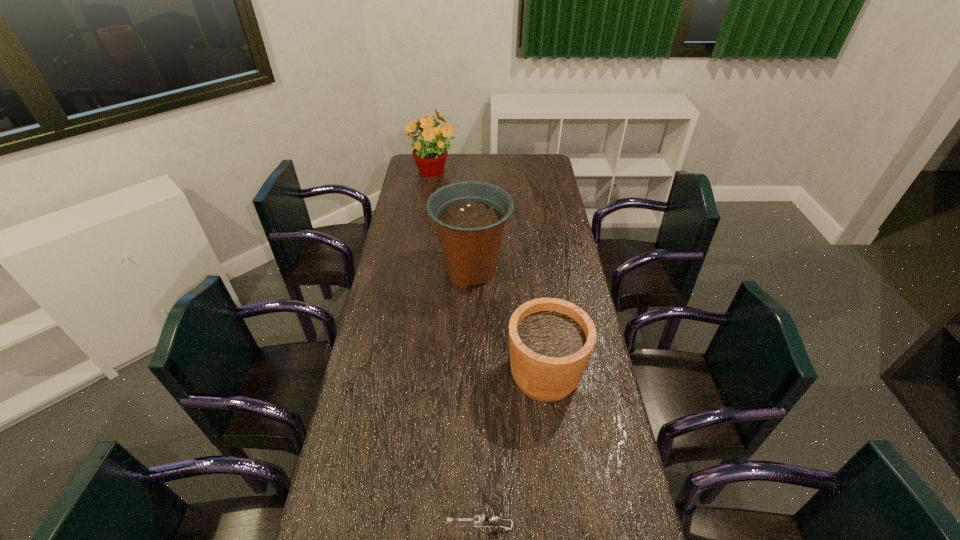
Identify the location of free space that is in between the nearest flowerpot and the second farthest flowerpot. The height and width of the screenshot is (540, 960). (508, 322).

Identify the location of free space that is in between the shortest object and the third tallest object. (513, 451).

Find the location of `vacant space in between the shortest object and the second shortest object`. vacant space in between the shortest object and the second shortest object is located at coordinates (513, 451).

The height and width of the screenshot is (540, 960). I want to click on empty space that is in between the shortest flowerpot and the third nearest object, so click(x=508, y=322).

Image resolution: width=960 pixels, height=540 pixels. I want to click on empty location between the nearest object and the second farthest object, so click(476, 399).

You are a GUI agent. You are given a task and a screenshot of the screen. Output one action in this format:
    pyautogui.click(x=<x>, y=<y>)
    Task: Click on the object identified as the second closest to the farthest object
    The image size is (960, 540).
    Given the screenshot: What is the action you would take?
    pyautogui.click(x=551, y=340)

Identify the location of object that can be found as the closest to the third nearest object. (551, 340).

Locate an element on the screen. The image size is (960, 540). flowerpot that stands as the closest to the third nearest object is located at coordinates (551, 340).

Select which flowerpot appears as the closest to the farthest object. Please provide its 2D coordinates. Your answer should be formatted as a tuple, i.e. [(x, y)], where the tuple contains the x and y coordinates of a point satisfying the conditions above.

[(470, 216)]

Find the location of a particular element. vacant region that satisfies the following two spatial constraints: 1. on the front side of the farthest object; 2. on the left side of the nearest flowerpot is located at coordinates (403, 375).